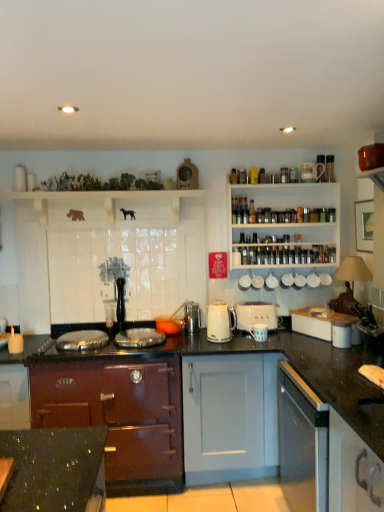
Question: Is white matte cabinet at right, which is the 2th cabinetry in bottom-to-top order, in front of or behind orange glass bowl at center, which is the 1th appliance from left to right, in the image?

Choices:
 (A) front
 (B) behind

Answer: (A)

Question: Would you say white matte cabinet at right, which is the 2th cabinetry in bottom-to-top order, is inside or outside orange glass bowl at center, which is the 1th appliance from left to right?

Choices:
 (A) outside
 (B) inside

Answer: (A)

Question: Based on their relative distances, which object is nearer to the white glossy cup at upper right, which appears as the 1th appliance when viewed from the right?

Choices:
 (A) white plastic toaster at center-right, marked as the 3th appliance in a right-to-left arrangement
 (B) clear glass spice jars at upper right
 (C) white matte cabinet at right, which is the 2th cabinetry in bottom-to-top order
 (D) metallic silver toaster at center, which is counted as the second appliance, starting from the left
 (E) white ceramic mug at center, positioned as the third appliance in left-to-right order

Answer: (B)

Question: Which of these objects is positioned closest to the white ceramic mugs at upper center, placed as the second appliance when sorted from right to left?

Choices:
 (A) white glossy cup at upper right, which appears as the 1th appliance when viewed from the right
 (B) white plastic toaster at center-right, marked as the 3th appliance in a right-to-left arrangement
 (C) white glossy electric kettle at center
 (D) clear glass spice jars at upper right
 (E) maroon wood stove at center, arranged as the first cabinetry when viewed from the left

Answer: (A)